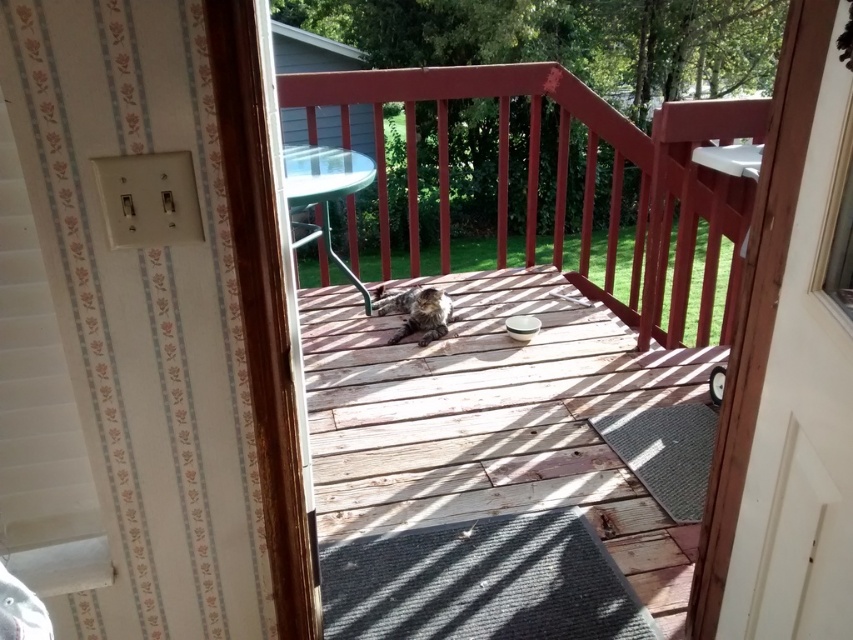
Question: Estimate the real-world distances between objects in this image. Which object is closer to the weathered wood deck at center?

Choices:
 (A) white wood door at center right
 (B) wooden deck at center
 (C) fuzzy brown cat at center

Answer: (C)

Question: Does wooden deck at center appear under fuzzy brown cat at center?

Choices:
 (A) yes
 (B) no

Answer: (B)

Question: Can you confirm if weathered wood deck at center is positioned to the left of wooden deck at center?

Choices:
 (A) yes
 (B) no

Answer: (A)

Question: Which point is closer to the camera?

Choices:
 (A) wooden deck at center
 (B) white wood door at center right
 (C) fuzzy brown cat at center
 (D) weathered wood deck at center

Answer: (B)

Question: Is weathered wood deck at center to the left of white wood door at center right from the viewer's perspective?

Choices:
 (A) yes
 (B) no

Answer: (A)

Question: Which object is positioned closest to the fuzzy brown cat at center?

Choices:
 (A) wooden deck at center
 (B) weathered wood deck at center
 (C) white wood door at center right

Answer: (B)